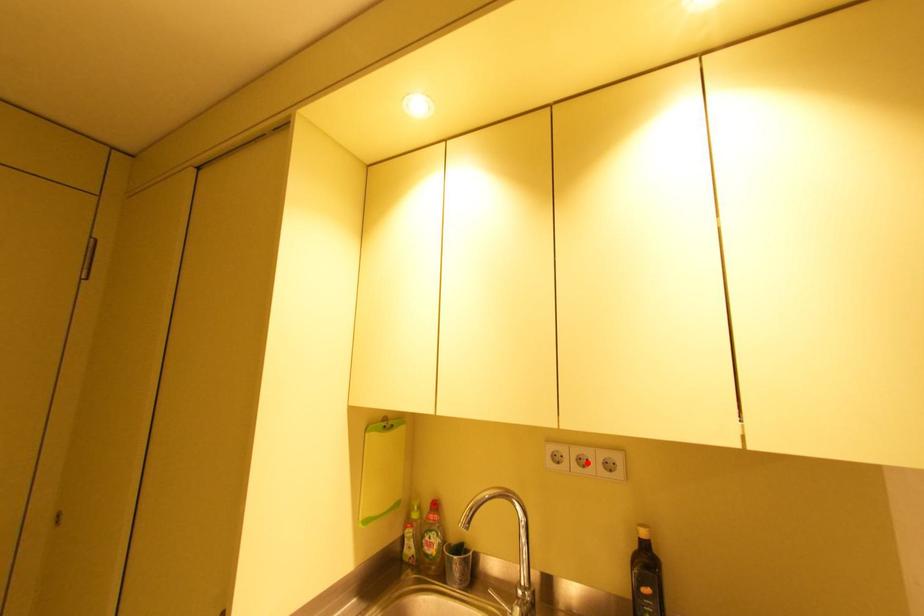
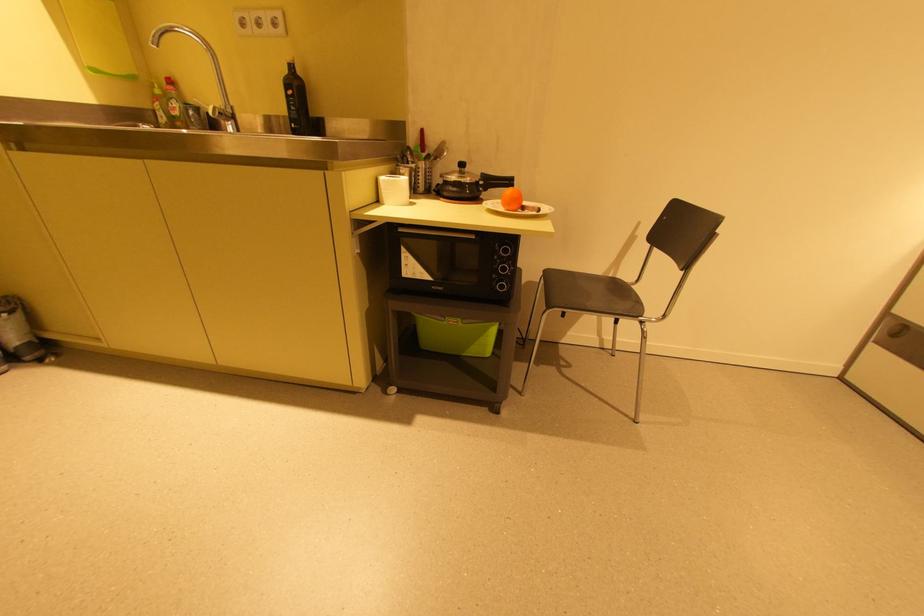
Where in the second image is the point corresponding to the highlighted location from the first image?

(263, 23)